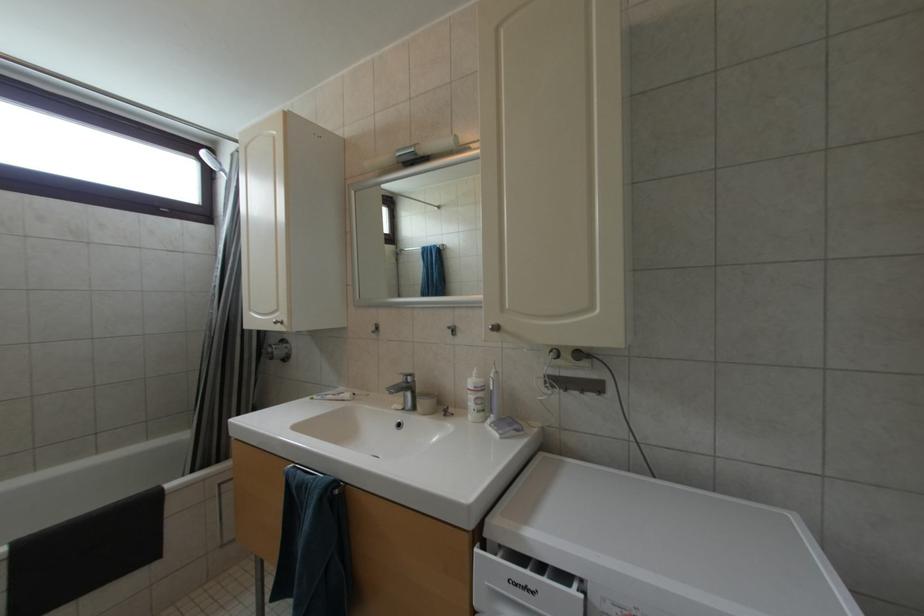
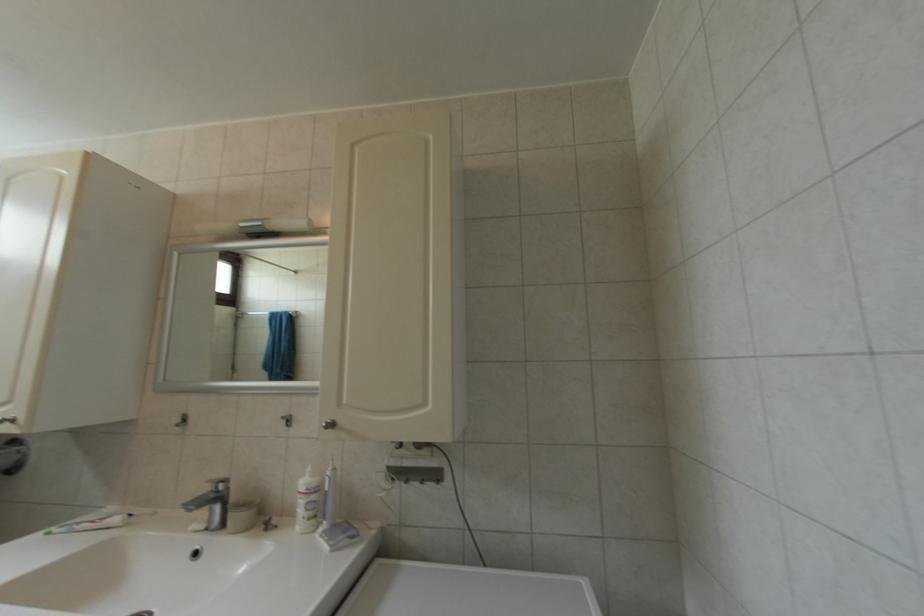
What movement of the cameraman would produce the second image?

The cameraman moved toward right, backward.